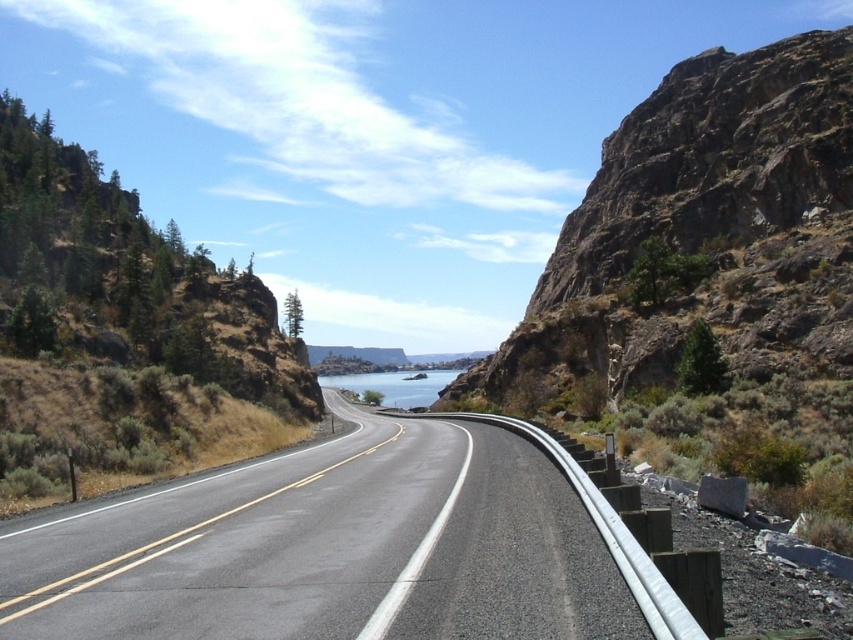
You are a photographer planning to capture the scenic view of the black asphalt highway at center and the clear blue water at center. Which object takes up more area in the image?

The clear blue water at center occupies more space than the black asphalt highway at center in the image.

You are driving a car with a 100 feet long trailer attached. You need to make a sharp turn on the road near the green textured rock at left and the clear blue water at center. Can you safely navigate the turn without hitting the rock or the water?

The green textured rock at left is 536.54 feet away from the clear blue water at center. Since the distance between them is greater than the length of your trailer, you can safely navigate the turn without hitting either the rock or the water.